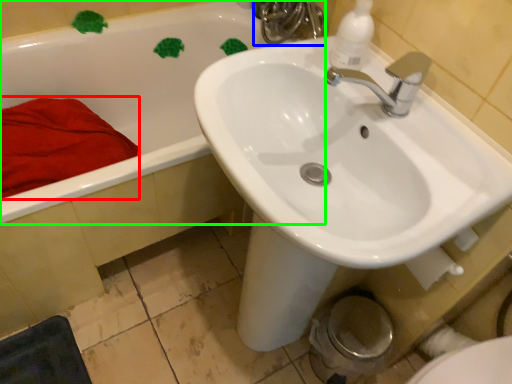
Question: Which object is positioned closest to bath towel (highlighted by a red box)? Select from plumbing fixture (highlighted by a blue box) and bathtub (highlighted by a green box).

Choices:
 (A) plumbing fixture
 (B) bathtub

Answer: (B)